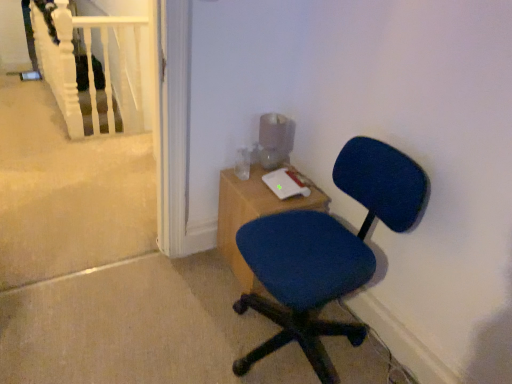
Locate an element on the screen. free spot above wooden desk at center (from a real-world perspective) is located at coordinates (279, 181).